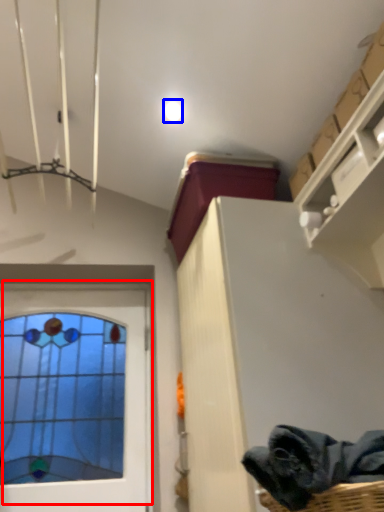
Question: Which of the following is the farthest to the observer, window (highlighted by a red box) or droplight (highlighted by a blue box)?

Choices:
 (A) window
 (B) droplight

Answer: (B)